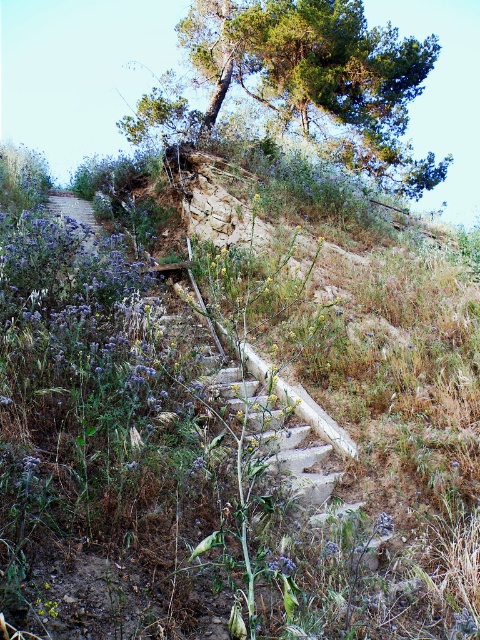
Question: Can you confirm if green leafy tree at upper center is wider than purple floral trail at upper left?

Choices:
 (A) yes
 (B) no

Answer: (A)

Question: Which point appears closest to the camera in this image?

Choices:
 (A) (82, 198)
 (B) (360, 72)

Answer: (A)

Question: Is green leafy tree at upper center to the left of purple floral trail at upper left from the viewer's perspective?

Choices:
 (A) yes
 (B) no

Answer: (B)

Question: Is green leafy tree at upper center positioned behind purple floral trail at upper left?

Choices:
 (A) no
 (B) yes

Answer: (B)